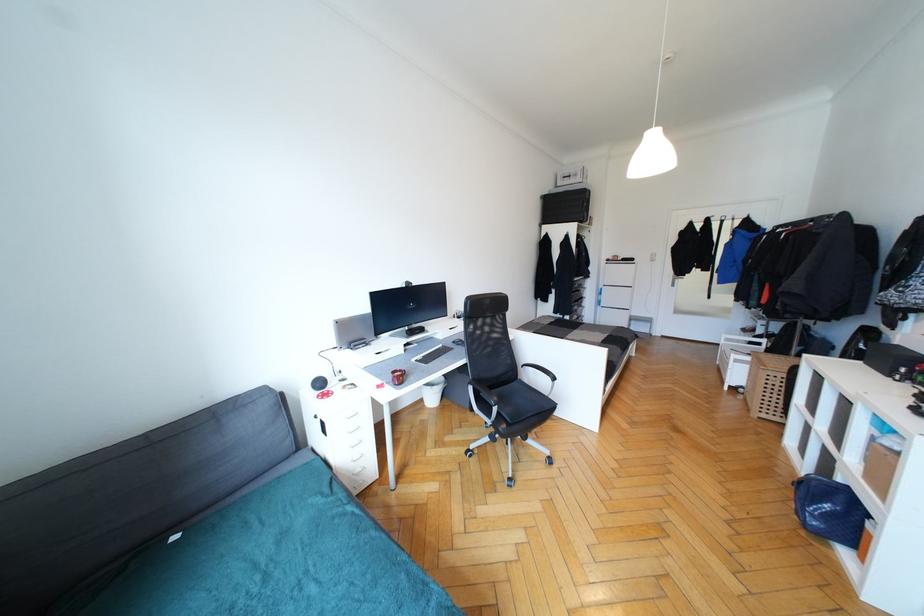
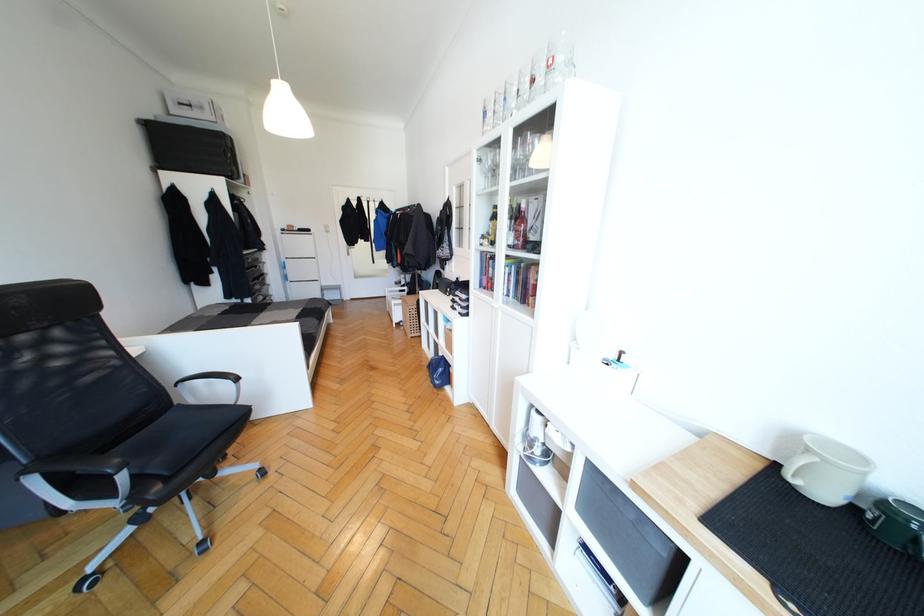
Question: The camera is either moving clockwise (left) or counter-clockwise (right) around the object. The first image is from the beginning of the video and the second image is from the end. Is the camera moving left or right when shooting the video?

Choices:
 (A) Left
 (B) Right

Answer: (A)